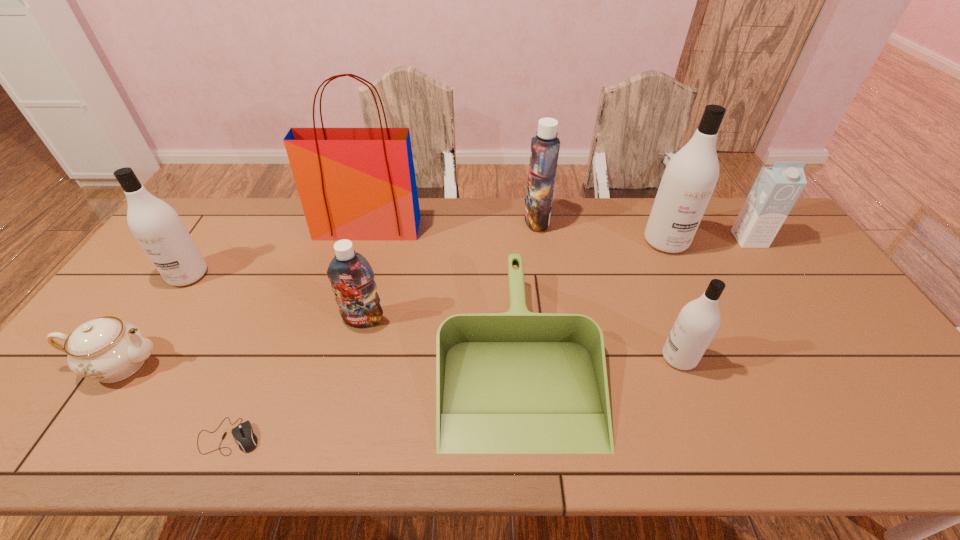
Locate an element on the screen. This screenshot has height=540, width=960. vacant space that is in between the eighth tallest object and the shopping bag is located at coordinates (244, 296).

Locate an element on the screen. The height and width of the screenshot is (540, 960). empty location between the farther blue shampoo and the blue shopping bag is located at coordinates (452, 224).

What are the coordinates of `vacant space that is in between the second smallest white shampoo and the shortest object` in the screenshot? It's located at (208, 355).

Where is `empty space that is in between the dustpan and the shopping bag`? empty space that is in between the dustpan and the shopping bag is located at coordinates pos(443,291).

This screenshot has width=960, height=540. I want to click on free point between the shopping bag and the ninth tallest object, so click(x=443, y=291).

Image resolution: width=960 pixels, height=540 pixels. What are the coordinates of `free point between the right blue shampoo and the chinaware` in the screenshot? It's located at (328, 292).

Find the location of a particular element. vacant space that's between the leftmost white shampoo and the smaller blue shampoo is located at coordinates (276, 297).

Point out which object is positioned as the fourth nearest to the shortest object. Please provide its 2D coordinates. Your answer should be formatted as a tuple, i.e. [(x, y)], where the tuple contains the x and y coordinates of a point satisfying the conditions above.

[(156, 226)]

Select which object is the seventh closest to the smaller blue shampoo. Please provide its 2D coordinates. Your answer should be formatted as a tuple, i.e. [(x, y)], where the tuple contains the x and y coordinates of a point satisfying the conditions above.

[(698, 321)]

Image resolution: width=960 pixels, height=540 pixels. In order to click on shampoo that can be found as the closest to the ninth shortest object in this screenshot , I will do `click(544, 153)`.